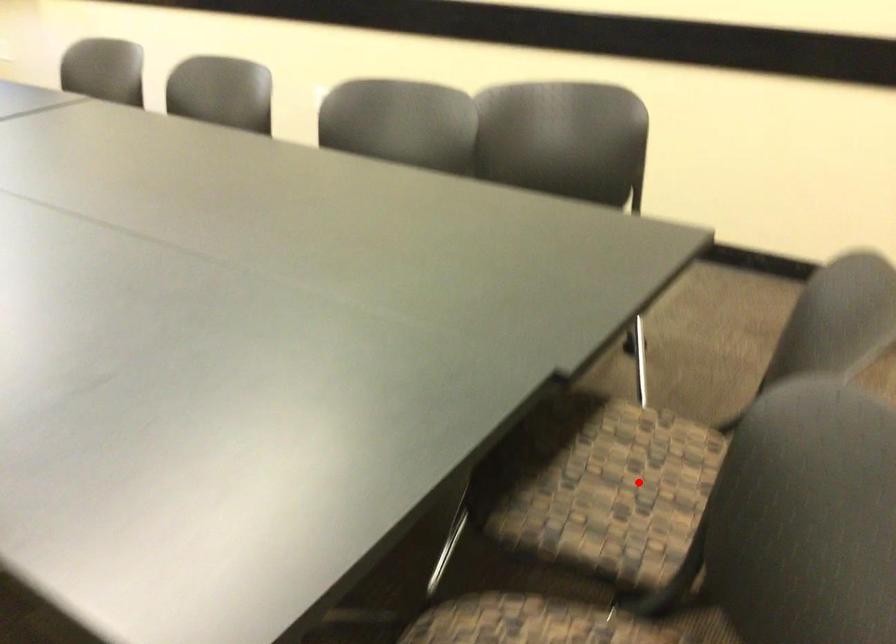
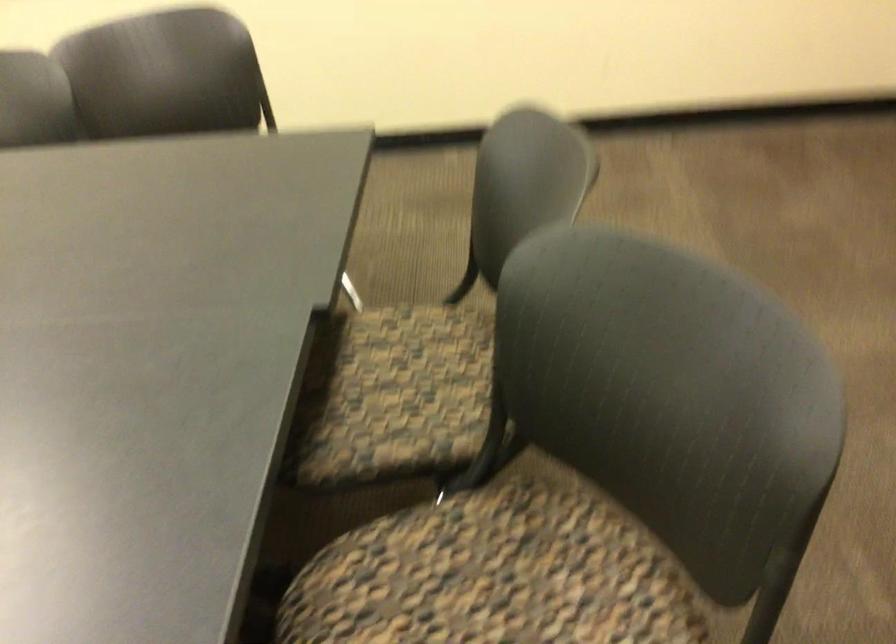
In the second image, find the point that corresponds to the highlighted location in the first image.

(415, 381)